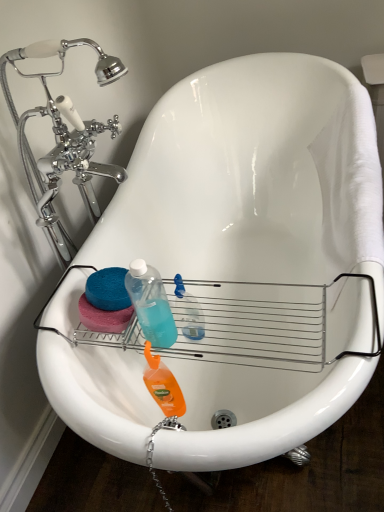
Question: Should I look upward or downward to see translucent plastic bottle at center, the 2th cleaning product in the bottom-to-top sequence?

Choices:
 (A) down
 (B) up

Answer: (A)

Question: Is orange matte liquid at center, which is the first cleaning product from bottom to top, outside translucent plastic bottle at center, the 2th cleaning product in the bottom-to-top sequence?

Choices:
 (A) no
 (B) yes

Answer: (B)

Question: Can translucent plastic bottle at center, marked as the 1th cleaning product in a top-to-bottom arrangement, be found inside orange matte liquid at center, which is the first cleaning product from bottom to top?

Choices:
 (A) no
 (B) yes

Answer: (A)

Question: Can you confirm if orange matte liquid at center, which is the first cleaning product from bottom to top, is smaller than translucent plastic bottle at center, marked as the 1th cleaning product in a top-to-bottom arrangement?

Choices:
 (A) yes
 (B) no

Answer: (B)

Question: From the image's perspective, is orange matte liquid at center, which is the first cleaning product from bottom to top, over translucent plastic bottle at center, the 2th cleaning product in the bottom-to-top sequence?

Choices:
 (A) yes
 (B) no

Answer: (B)

Question: From a real-world perspective, is orange matte liquid at center, which is the first cleaning product from bottom to top, over translucent plastic bottle at center, the 2th cleaning product in the bottom-to-top sequence?

Choices:
 (A) no
 (B) yes

Answer: (A)

Question: Could you tell me if orange matte liquid at center, which is the first cleaning product from bottom to top, is facing translucent plastic bottle at center, marked as the 1th cleaning product in a top-to-bottom arrangement?

Choices:
 (A) yes
 (B) no

Answer: (B)

Question: Is translucent plastic bottle at center, the 2th cleaning product in the bottom-to-top sequence, smaller than orange matte liquid at center, which is the second cleaning product in top-to-bottom order?

Choices:
 (A) yes
 (B) no

Answer: (A)

Question: Could you tell me if translucent plastic bottle at center, marked as the 1th cleaning product in a top-to-bottom arrangement, is turned towards orange matte liquid at center, which is the second cleaning product in top-to-bottom order?

Choices:
 (A) yes
 (B) no

Answer: (A)

Question: Is translucent plastic bottle at center, marked as the 1th cleaning product in a top-to-bottom arrangement, completely or partially outside of orange matte liquid at center, which is the second cleaning product in top-to-bottom order?

Choices:
 (A) no
 (B) yes

Answer: (B)

Question: Could orange matte liquid at center, which is the second cleaning product in top-to-bottom order, be considered to be inside translucent plastic bottle at center, marked as the 1th cleaning product in a top-to-bottom arrangement?

Choices:
 (A) yes
 (B) no

Answer: (B)

Question: Would you consider translucent plastic bottle at center, the 2th cleaning product in the bottom-to-top sequence, to be distant from orange matte liquid at center, which is the first cleaning product from bottom to top?

Choices:
 (A) no
 (B) yes

Answer: (A)

Question: Is translucent plastic bottle at center, marked as the 1th cleaning product in a top-to-bottom arrangement, wider than orange matte liquid at center, which is the first cleaning product from bottom to top?

Choices:
 (A) no
 (B) yes

Answer: (B)

Question: Is translucent plastic bottle at center, marked as the 1th cleaning product in a top-to-bottom arrangement, in front of or behind orange matte liquid at center, which is the second cleaning product in top-to-bottom order, in the image?

Choices:
 (A) front
 (B) behind

Answer: (B)